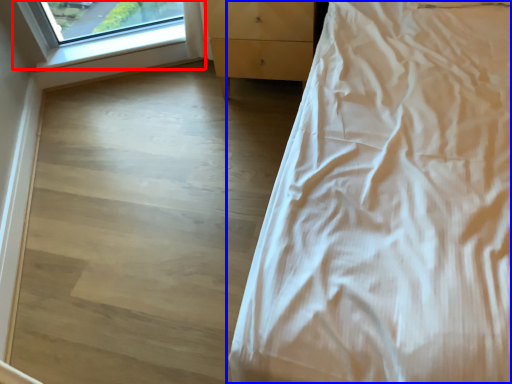
Question: Which point is further to the camera, window (highlighted by a red box) or bed (highlighted by a blue box)?

Choices:
 (A) window
 (B) bed

Answer: (A)